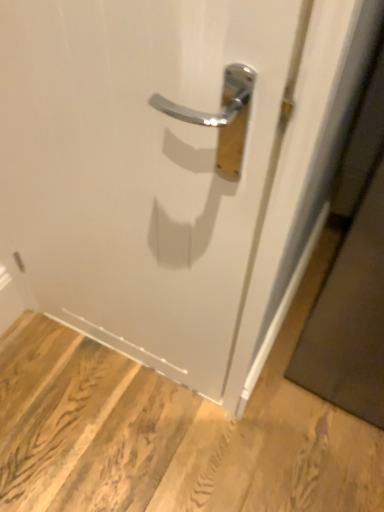
Question: Should I look upward or downward to see wooden floor at lower left?

Choices:
 (A) up
 (B) down

Answer: (B)